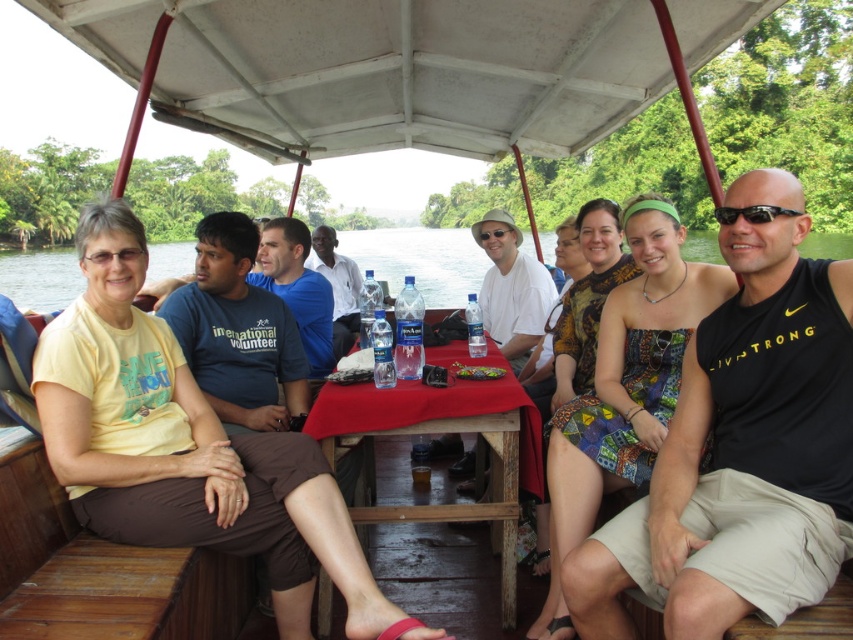
Consider the image. Is red cloth-covered table at center wider than white matte shirt at center?

Indeed, red cloth-covered table at center has a greater width compared to white matte shirt at center.

Can you confirm if red cloth-covered table at center is bigger than white matte shirt at center?

Yes, red cloth-covered table at center is bigger than white matte shirt at center.

Is point (462, 566) less distant than point (490, 285)?

Yes, point (462, 566) is closer to viewer.

You are a GUI agent. You are given a task and a screenshot of the screen. Output one action in this format:
    pyautogui.click(x=<x>, y=<y>)
    Task: Click on the red cloth-covered table at center
    Image resolution: width=853 pixels, height=640 pixels.
    Given the screenshot: What is the action you would take?
    pyautogui.click(x=444, y=433)

Can you confirm if blue cotton shirt at center is positioned above black plastic sunglasses at right?

No, blue cotton shirt at center is not above black plastic sunglasses at right.

Between blue cotton shirt at center and black plastic sunglasses at right, which one has less height?

blue cotton shirt at center

Between point (325, 324) and point (762, 211), which one is positioned in front?

Point (762, 211)

I want to click on blue cotton shirt at center, so click(297, 289).

Does white matte shirt at center come in front of black plastic sunglasses at right?

No, white matte shirt at center is further to the viewer.

Does white matte shirt at center have a lesser height compared to black plastic sunglasses at right?

Correct, white matte shirt at center is not as tall as black plastic sunglasses at right.

Measure the distance between white matte shirt at center and camera.

white matte shirt at center is 5.28 meters from camera.

The image size is (853, 640). I want to click on white matte shirt at center, so click(x=511, y=289).